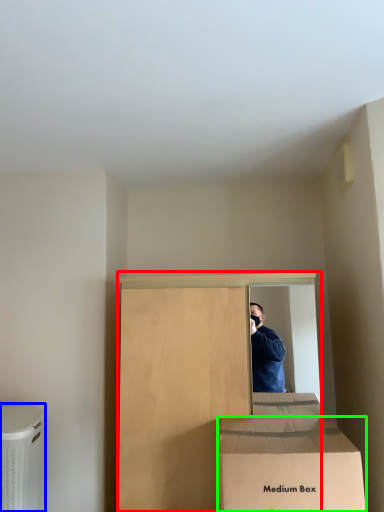
Question: Which object is positioned farthest from furniture (highlighted by a red box)? Select from cardboard box (highlighted by a blue box) and box (highlighted by a green box).

Choices:
 (A) cardboard box
 (B) box

Answer: (A)